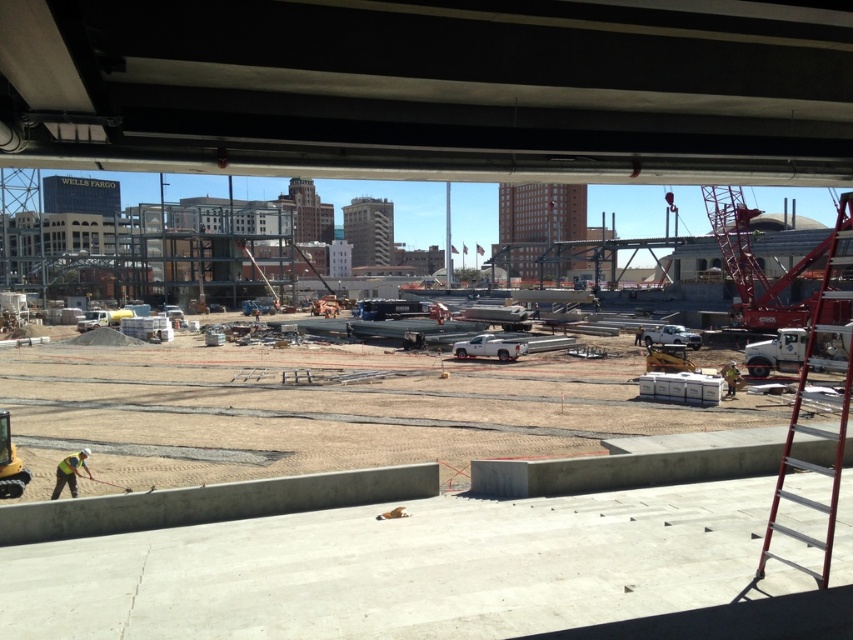
Between point (791, 308) and point (78, 464), which one is positioned in front?

Point (78, 464) is more forward.

Does point (802, 260) come closer to viewer compared to point (70, 470)?

No, it is behind (70, 470).

Find the location of a particular element. red metallic crane at upper right is located at coordinates (755, 266).

Who is positioned more to the left, concrete at center or red metallic crane at upper right?

concrete at center is more to the left.

Can you confirm if concrete at center is positioned above red metallic crane at upper right?

No, concrete at center is not above red metallic crane at upper right.

Who is more distant from viewer, [273,454] or [718,209]?

The point [718,209] is more distant.

Where is `concrete at center`? concrete at center is located at coordinates (369, 500).

Which is below, concrete at center or yellow reflective vest at lower left?

yellow reflective vest at lower left

Does concrete at center have a lesser width compared to yellow reflective vest at lower left?

No.

Describe the element at coordinates (369, 500) in the screenshot. The height and width of the screenshot is (640, 853). I see `concrete at center` at that location.

Image resolution: width=853 pixels, height=640 pixels. What are the coordinates of `concrete at center` in the screenshot? It's located at tap(369, 500).